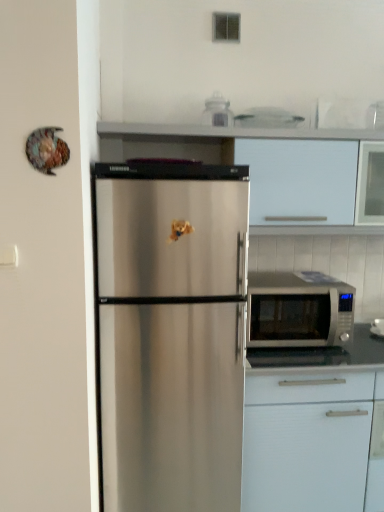
Question: Considering the relative positions of silver metallic microwave at right and white matte cabinet at lower right, acting as the 1th cabinetry starting from the bottom, in the image provided, is silver metallic microwave at right to the left or to the right of white matte cabinet at lower right, acting as the 1th cabinetry starting from the bottom,?

Choices:
 (A) left
 (B) right

Answer: (A)

Question: Relative to white matte cabinet at lower right, acting as the 1th cabinetry starting from the bottom, is silver metallic microwave at right in front or behind?

Choices:
 (A) front
 (B) behind

Answer: (B)

Question: Which is nearer to the white matte cabinet at lower right, the second cabinetry from the top?

Choices:
 (A) white matte cabinet at upper center, the first cabinetry viewed from the top
 (B) silver metallic microwave at right

Answer: (B)

Question: Which object is positioned farthest from the white matte cabinet at upper center, the first cabinetry viewed from the top?

Choices:
 (A) white matte cabinet at lower right, acting as the 1th cabinetry starting from the bottom
 (B) silver metallic microwave at right

Answer: (A)